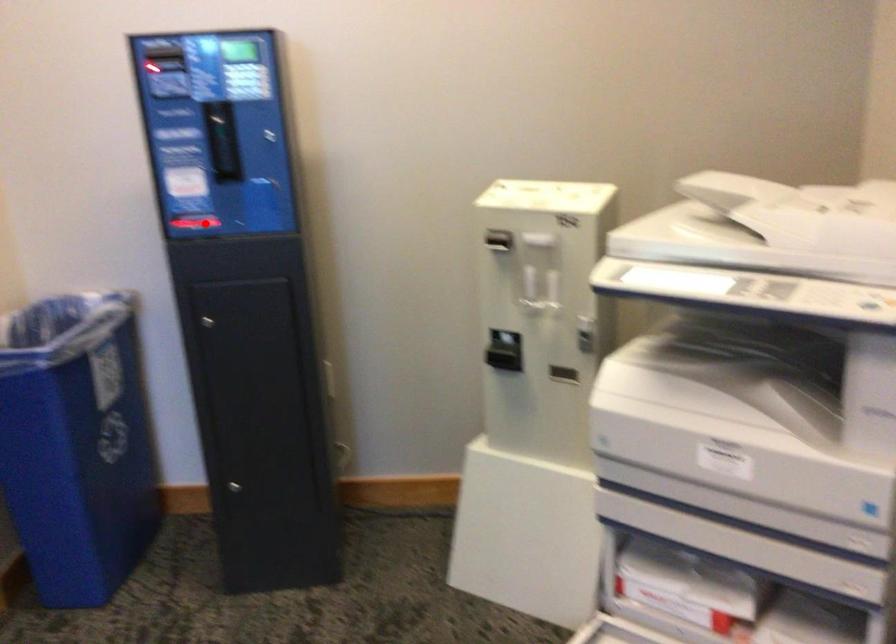
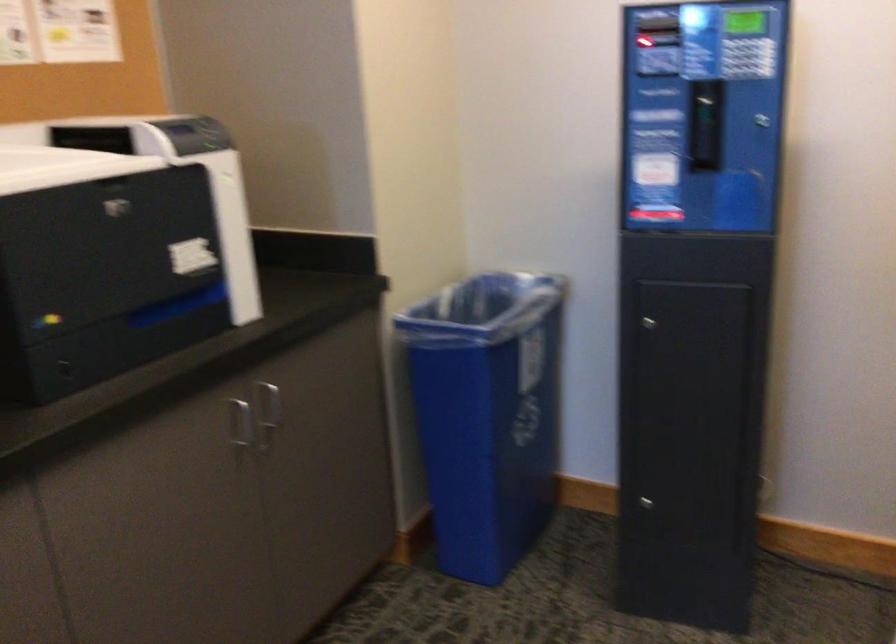
Question: I am providing you with two images of the same scene from different viewpoints. Given a red point in image1, look at the same physical point in image2. Is it:

Choices:
 (A) Closer to the viewpoint
 (B) Farther from the viewpoint

Answer: (A)